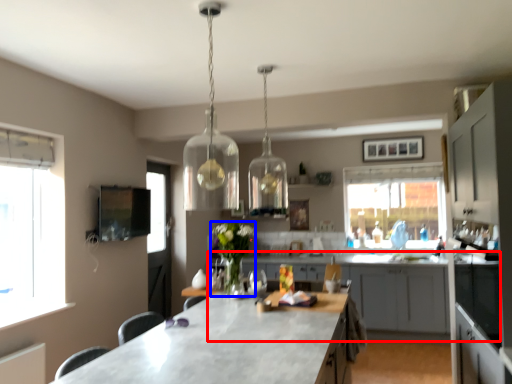
Question: Which object is closer to the camera taking this photo, cabinetry (highlighted by a red box) or flower (highlighted by a blue box)?

Choices:
 (A) cabinetry
 (B) flower

Answer: (B)